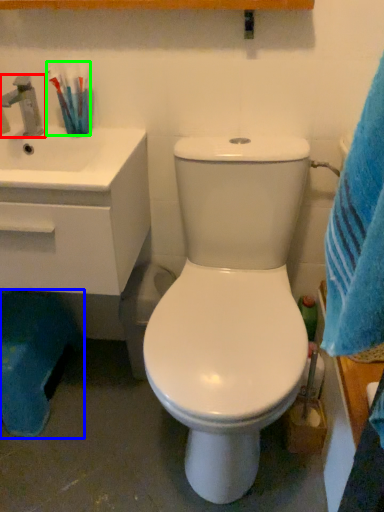
Question: Considering the real-world distances, which object is farthest from tap (highlighted by a red box)? potty (highlighted by a blue box) or toothbrush (highlighted by a green box)?

Choices:
 (A) potty
 (B) toothbrush

Answer: (A)